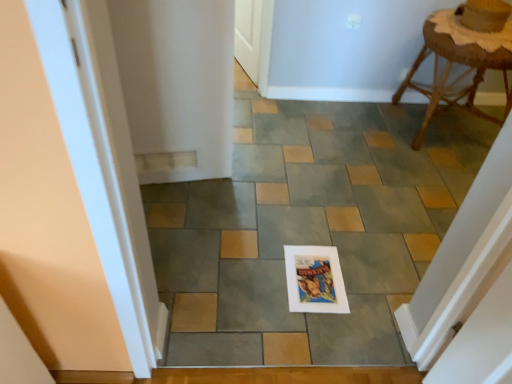
Locate an element on the screen. Image resolution: width=512 pixels, height=384 pixels. free point below rattan stool at upper right (from a real-world perspective) is located at coordinates (441, 127).